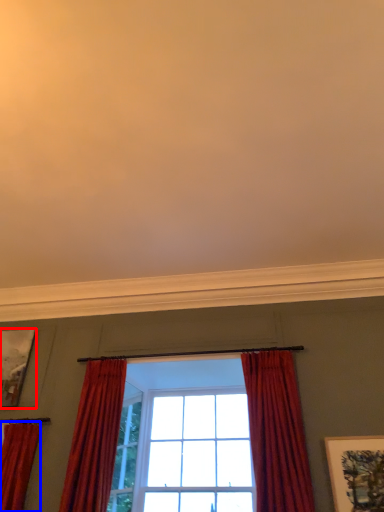
Question: Which object appears closest to the camera in this image, picture frame (highlighted by a red box) or curtain (highlighted by a blue box)?

Choices:
 (A) picture frame
 (B) curtain

Answer: (B)